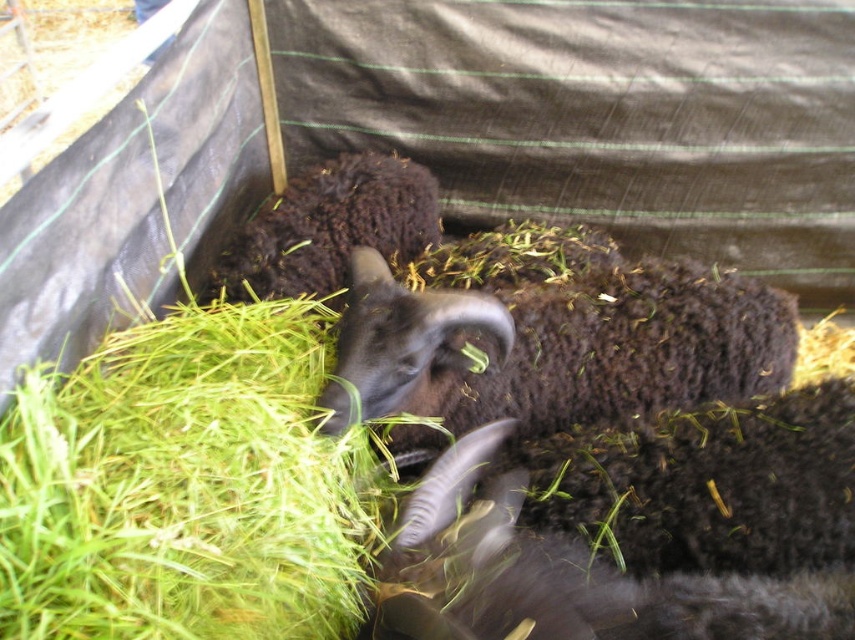
Question: Which object is closer to the camera taking this photo?

Choices:
 (A) dark woolen goat at center
 (B) dark woolen sheep at center
 (C) green grass at lower left

Answer: (C)

Question: Where is dark woolen goat at center located in relation to dark brown woolen sheep at center in the image?

Choices:
 (A) below
 (B) above

Answer: (B)

Question: Which object appears closest to the camera in this image?

Choices:
 (A) green grass at lower left
 (B) dark woolen sheep at center

Answer: (A)

Question: Does dark woolen goat at center come in front of dark brown woolen sheep at center?

Choices:
 (A) yes
 (B) no

Answer: (B)

Question: Is dark woolen goat at center behind dark woolen sheep at center?

Choices:
 (A) no
 (B) yes

Answer: (A)

Question: Estimate the real-world distances between objects in this image. Which object is closer to the dark woolen sheep at center?

Choices:
 (A) dark brown woolen sheep at center
 (B) dark woolen goat at center

Answer: (B)